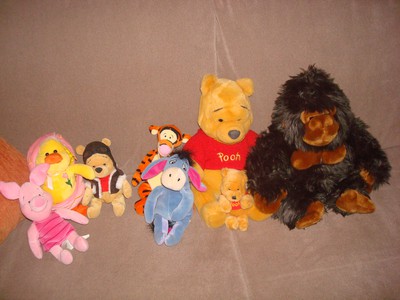
Find the location of `teddy bears from winnie the pooh`. teddy bears from winnie the pooh is located at coordinates (223, 145), (239, 197), (160, 154), (169, 187), (109, 180), (47, 224).